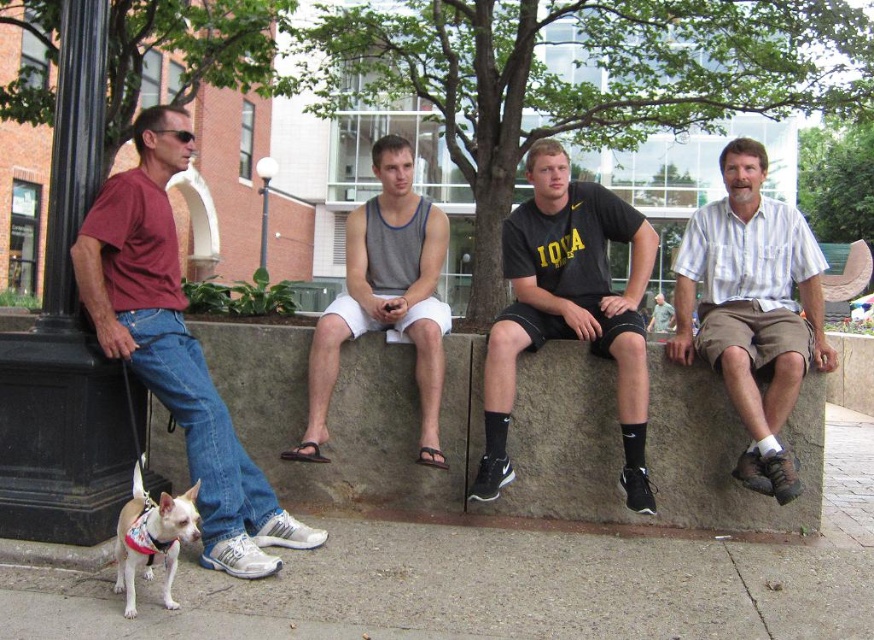
Question: Based on their relative distances, which object is nearer to the gray striped shirt at center?

Choices:
 (A) gray concrete bench at center
 (B) gray tank top at center
 (C) black matte t-shirt at center

Answer: (C)

Question: Does gray concrete bench at center appear over maroon t-shirt at left?

Choices:
 (A) no
 (B) yes

Answer: (A)

Question: Where is maroon t-shirt at left located in relation to black matte t-shirt at center in the image?

Choices:
 (A) right
 (B) left

Answer: (B)

Question: Observing the image, what is the correct spatial positioning of white fur dog at lower left in reference to gray striped shirt at center?

Choices:
 (A) left
 (B) right

Answer: (A)

Question: Among these points, which one is nearest to the camera?

Choices:
 (A) (808, 227)
 (B) (255, 554)
 (C) (602, 209)
 (D) (354, 353)

Answer: (B)

Question: Which object is positioned farthest from the gray striped shirt at center?

Choices:
 (A) white fur dog at lower left
 (B) gray concrete at lower left

Answer: (A)